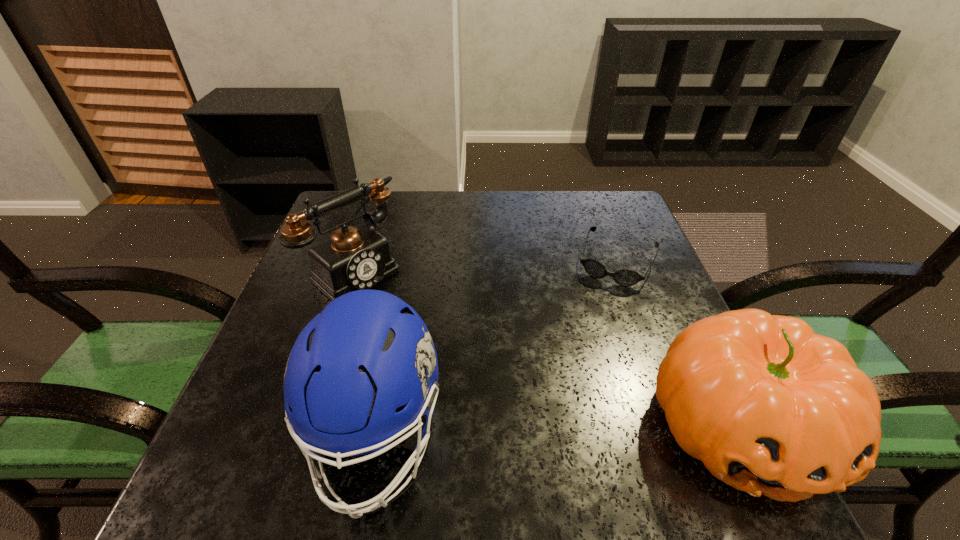
Image resolution: width=960 pixels, height=540 pixels. Identify the location of vacant area that lies between the football helmet and the pumpkin. (558, 431).

In order to click on empty space between the sunglasses and the football helmet in this screenshot , I will do `click(496, 348)`.

The height and width of the screenshot is (540, 960). I want to click on object identified as the second closest to the football helmet, so pyautogui.click(x=770, y=407).

Find the location of a particular element. object that stands as the third closest to the shortest object is located at coordinates (355, 258).